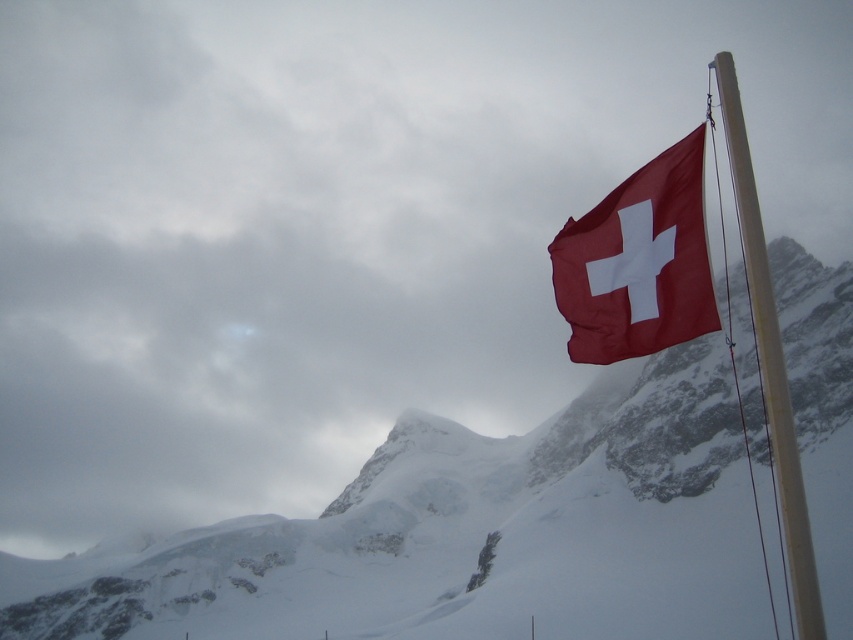
Does snowy rock at upper right have a lesser height compared to matte red flag at upper right?

No.

Is snowy rock at upper right closer to camera compared to matte red flag at upper right?

No, snowy rock at upper right is further to the viewer.

Does point (675, 522) come in front of point (635, 291)?

No, it is behind (635, 291).

At what (x,y) coordinates should I click in order to perform the action: click on snowy rock at upper right. Please return your answer as a coordinate pair (x, y). Image resolution: width=853 pixels, height=640 pixels. Looking at the image, I should click on (463, 536).

Who is taller, matte red flag at upper right or white plastic flag pole at upper right?

Standing taller between the two is white plastic flag pole at upper right.

Is point (646, 269) behind point (775, 348)?

That is True.

Locate an element on the screen. The image size is (853, 640). matte red flag at upper right is located at coordinates (637, 262).

Between snowy rock at upper right and white plastic flag pole at upper right, which one appears on the left side from the viewer's perspective?

From the viewer's perspective, snowy rock at upper right appears more on the left side.

Is point (525, 532) farther from viewer compared to point (795, 522)?

Yes.

Who is more distant from viewer, (405, 541) or (788, 458)?

The point (405, 541) is behind.

Where is `snowy rock at upper right`? The width and height of the screenshot is (853, 640). snowy rock at upper right is located at coordinates (463, 536).